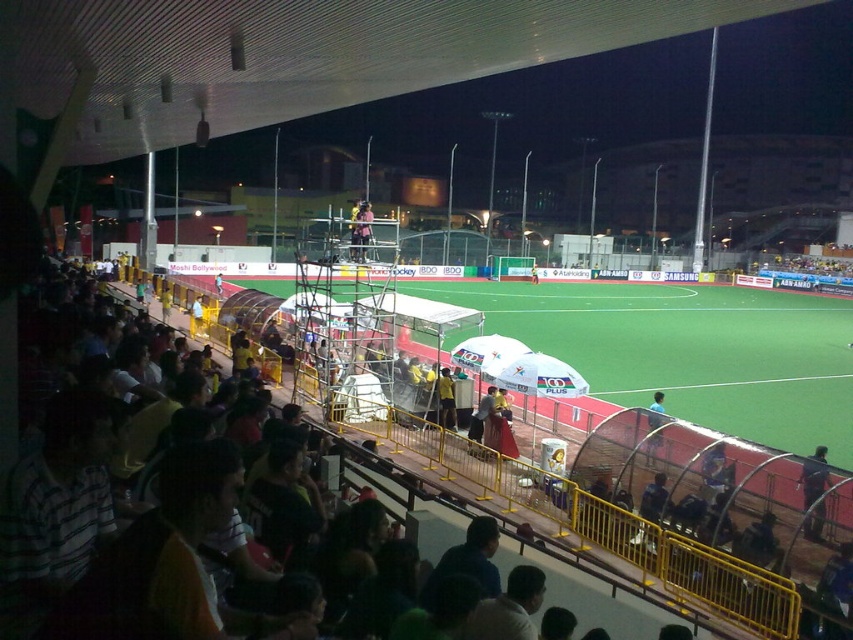
Looking at this image, is dark blue uniform at center below matte pink shirt at center?

Indeed, dark blue uniform at center is positioned under matte pink shirt at center.

Does dark blue uniform at center have a lesser height compared to matte pink shirt at center?

Correct, dark blue uniform at center is not as tall as matte pink shirt at center.

Does point (820, 506) lie in front of point (360, 204)?

That is True.

The height and width of the screenshot is (640, 853). Identify the location of dark blue uniform at center. (814, 490).

Does green artificial turf at center appear under dark blue uniform at center?

Actually, green artificial turf at center is above dark blue uniform at center.

Is point (729, 381) behind point (821, 490)?

Yes, it is behind point (821, 490).

This screenshot has width=853, height=640. Find the location of `green artificial turf at center`. green artificial turf at center is located at coordinates (689, 352).

Consider the image. Does green artificial turf at center have a smaller size compared to matte pink shirt at center?

No.

Is green artificial turf at center closer to the viewer compared to matte pink shirt at center?

That is False.

Identify the location of green artificial turf at center. This screenshot has height=640, width=853. (689, 352).